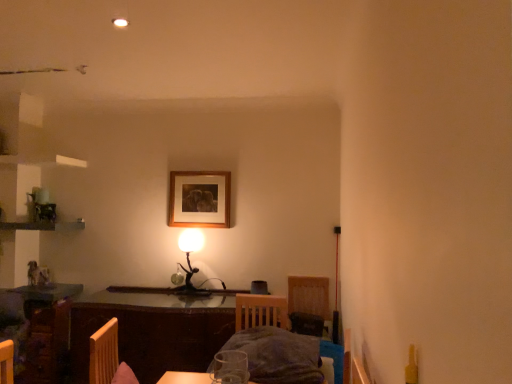
This screenshot has height=384, width=512. I want to click on wooden picture frame at upper center, so click(199, 199).

This screenshot has width=512, height=384. I want to click on dark gray fabric bed at center, so click(274, 342).

Measure the distance between velvet dark gray armchair at lower center and camera.

velvet dark gray armchair at lower center and camera are 3.17 meters apart from each other.

What are the coordinates of `wooden picture frame at upper center` in the screenshot? It's located at (199, 199).

Between point (190, 287) and point (119, 318), which one is positioned in front?

The point (119, 318) is closer to the camera.

Is metallic gold table lamp at center positioned far away from wooden table at center?

No, there isn't a large distance between metallic gold table lamp at center and wooden table at center.

Looking at this image, which object is positioned more to the right, metallic gold table lamp at center or wooden table at center?

metallic gold table lamp at center is more to the right.

Is metallic gold table lamp at center positioned in front of wooden table at center?

No, it is not.

Is velvet dark gray armchair at lower center completely or partially outside of wooden picture frame at upper center?

velvet dark gray armchair at lower center lies outside wooden picture frame at upper center's area.

Is velvet dark gray armchair at lower center wider or thinner than wooden picture frame at upper center?

Considering their sizes, velvet dark gray armchair at lower center looks broader than wooden picture frame at upper center.

Who is shorter, velvet dark gray armchair at lower center or wooden picture frame at upper center?

wooden picture frame at upper center is shorter.

Does velvet dark gray armchair at lower center touch wooden picture frame at upper center?

No, velvet dark gray armchair at lower center is not making contact with wooden picture frame at upper center.

Find the location of a particular element. The width and height of the screenshot is (512, 384). table below the velvet dark gray armchair at lower center (from the image's perspective) is located at coordinates (154, 329).

From the image's perspective, is wooden table at center over velvet dark gray armchair at lower center?

No, from the image's perspective, wooden table at center is not over velvet dark gray armchair at lower center.

Is wooden table at center touching velvet dark gray armchair at lower center?

No, wooden table at center is not with velvet dark gray armchair at lower center.

Who is smaller, wooden table at center or metallic gold table lamp at center?

metallic gold table lamp at center is smaller.

Does wooden table at center have a lesser height compared to metallic gold table lamp at center?

No.

Is wooden table at center in front of metallic gold table lamp at center?

Yes, the depth of wooden table at center is less than that of metallic gold table lamp at center.

Looking at their sizes, would you say wooden table at center is wider or thinner than metallic gold table lamp at center?

In the image, wooden table at center appears to be wider than metallic gold table lamp at center.

Is wooden picture frame at upper center facing towards wooden table at center?

No, wooden picture frame at upper center is not oriented towards wooden table at center.

Does wooden picture frame at upper center have a smaller size compared to wooden table at center?

Indeed, wooden picture frame at upper center has a smaller size compared to wooden table at center.

Are wooden picture frame at upper center and wooden table at center making contact?

No, wooden picture frame at upper center is not next to wooden table at center.

How much distance is there between wooden picture frame at upper center and dark gray fabric bed at center?

3.62 feet.

Between point (208, 185) and point (242, 323), which one is positioned behind?

The point (208, 185) is farther from the camera.

Which object is closer to the camera, wooden picture frame at upper center or dark gray fabric bed at center?

dark gray fabric bed at center.

Does wooden picture frame at upper center have a lesser width compared to dark gray fabric bed at center?

Yes.

From a real-world perspective, is velvet dark gray armchair at lower center beneath metallic gold table lamp at center?

Yes, from a real-world perspective, velvet dark gray armchair at lower center is beneath metallic gold table lamp at center.

Would you say velvet dark gray armchair at lower center is a long distance from metallic gold table lamp at center?

No, velvet dark gray armchair at lower center is not far from metallic gold table lamp at center.

Is point (312, 290) closer to camera compared to point (201, 237)?

That is True.

Image resolution: width=512 pixels, height=384 pixels. Identify the location of table lamp positioned vertically above the wooden table at center (from a real-world perspective). (189, 260).

Locate an element on the screen. The height and width of the screenshot is (384, 512). picture frame located above the velvet dark gray armchair at lower center (from the image's perspective) is located at coordinates (199, 199).

Based on the photo, when comparing their distances from wooden table at center, does velvet dark gray armchair at lower center or dark gray fabric bed at center seem closer?

dark gray fabric bed at center is positioned closer to the anchor wooden table at center.

Considering their positions, is dark gray fabric bed at center positioned further to velvet dark gray armchair at lower center than wooden picture frame at upper center?

wooden picture frame at upper center.

Estimate the real-world distances between objects in this image. Which object is closer to dark gray fabric bed at center, metallic gold table lamp at center or wooden table at center?

The object closer to dark gray fabric bed at center is wooden table at center.

From the image, which object appears to be nearer to wooden table at center, dark gray fabric bed at center or wooden picture frame at upper center?

dark gray fabric bed at center lies closer to wooden table at center than the other object.

Based on their spatial positions, is wooden table at center or dark gray fabric bed at center closer to velvet dark gray armchair at lower center?

Based on the image, dark gray fabric bed at center appears to be nearer to velvet dark gray armchair at lower center.

When comparing their distances from wooden picture frame at upper center, does metallic gold table lamp at center or dark gray fabric bed at center seem further?

Based on the image, dark gray fabric bed at center appears to be further to wooden picture frame at upper center.

Looking at this image, which object lies further to the anchor point dark gray fabric bed at center, wooden table at center or velvet dark gray armchair at lower center?

The object further to dark gray fabric bed at center is velvet dark gray armchair at lower center.

In the scene shown: From the image, which object appears to be nearer to wooden picture frame at upper center, dark gray fabric bed at center or metallic gold table lamp at center?

metallic gold table lamp at center.

This screenshot has width=512, height=384. I want to click on armchair between dark gray fabric bed at center and metallic gold table lamp at center in the front-back direction, so click(309, 295).

Locate an element on the screen. This screenshot has height=384, width=512. table lamp positioned between dark gray fabric bed at center and wooden picture frame at upper center from near to far is located at coordinates (189, 260).

At what (x,y) coordinates should I click in order to perform the action: click on bed situated between wooden table at center and velvet dark gray armchair at lower center from left to right. Please return your answer as a coordinate pair (x, y). Image resolution: width=512 pixels, height=384 pixels. Looking at the image, I should click on (274, 342).

Find the location of a particular element. The height and width of the screenshot is (384, 512). armchair between wooden picture frame at upper center and wooden table at center in the vertical direction is located at coordinates (309, 295).